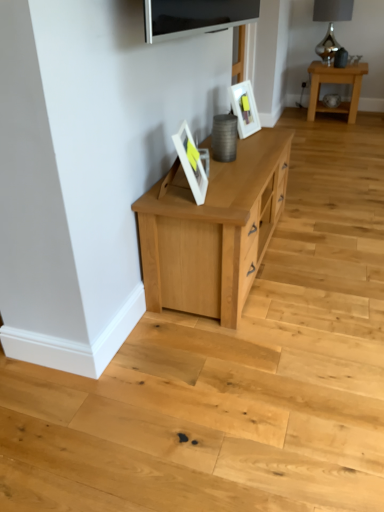
Question: From a real-world perspective, is white glossy picture frame at upper center, the second picture frame in the left-to-right sequence, positioned above or below matte white picture frame at center, acting as the 2th picture frame starting from the top?

Choices:
 (A) above
 (B) below

Answer: (B)

Question: Considering the positions of white glossy picture frame at upper center, the 2th picture frame positioned from the bottom, and matte white picture frame at center, which is the second picture frame from back to front, in the image, is white glossy picture frame at upper center, the 2th picture frame positioned from the bottom, taller or shorter than matte white picture frame at center, which is the second picture frame from back to front,?

Choices:
 (A) tall
 (B) short

Answer: (A)

Question: Which is farther from the light oak table at upper right?

Choices:
 (A) satin silver lamp at upper right
 (B) matte white picture frame at center, which is counted as the first picture frame, starting from the front
 (C) flat-screen tv at upper center
 (D) white glossy picture frame at upper center, which appears as the 2th picture frame when viewed from the front

Answer: (B)

Question: Estimate the real-world distances between objects in this image. Which object is closer to the light oak table at upper right?

Choices:
 (A) white glossy picture frame at upper center, the second picture frame in the left-to-right sequence
 (B) flat-screen tv at upper center
 (C) matte white picture frame at center, acting as the 2th picture frame starting from the top
 (D) satin silver lamp at upper right

Answer: (D)